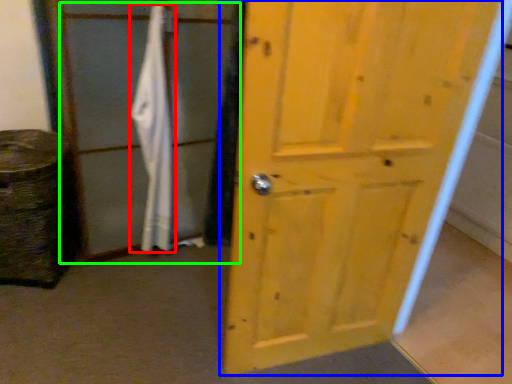
Question: Estimate the real-world distances between objects in this image. Which object is farther from bath towel (highlighted by a red box), door (highlighted by a blue box) or screen door (highlighted by a green box)?

Choices:
 (A) door
 (B) screen door

Answer: (A)